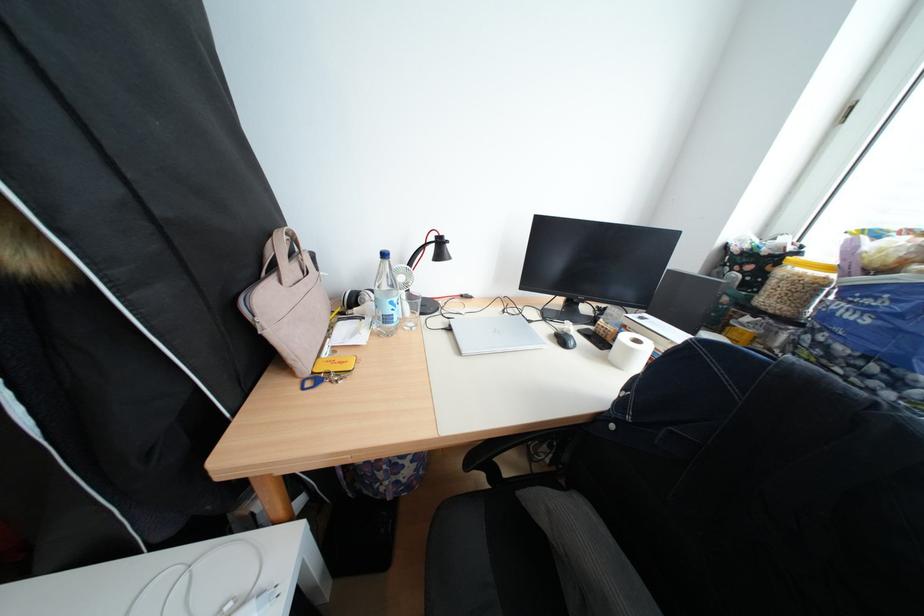
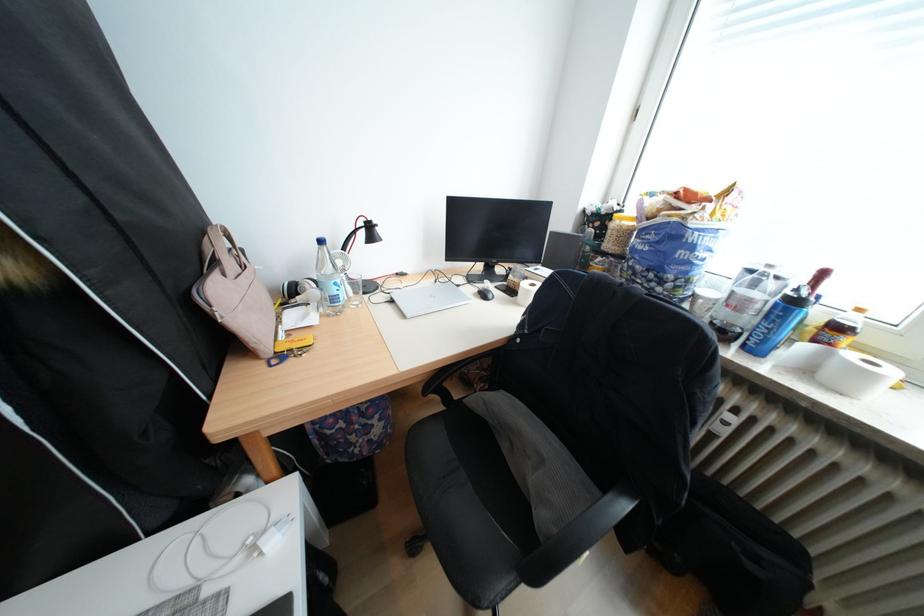
In the second image, find the point that corresponds to (563,338) in the first image.

(487, 296)